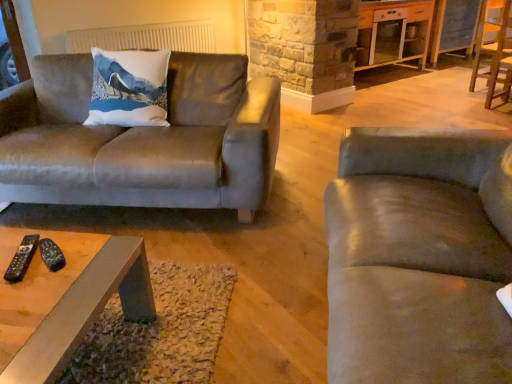
Locate an element on the screen. Image resolution: width=512 pixels, height=384 pixels. blank space situated above white fabric radiator at upper center (from a real-world perspective) is located at coordinates (143, 16).